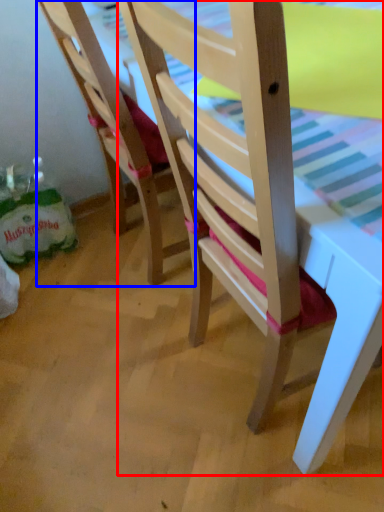
Question: Which object is further to the camera taking this photo, chair (highlighted by a red box) or chair (highlighted by a blue box)?

Choices:
 (A) chair
 (B) chair

Answer: (B)